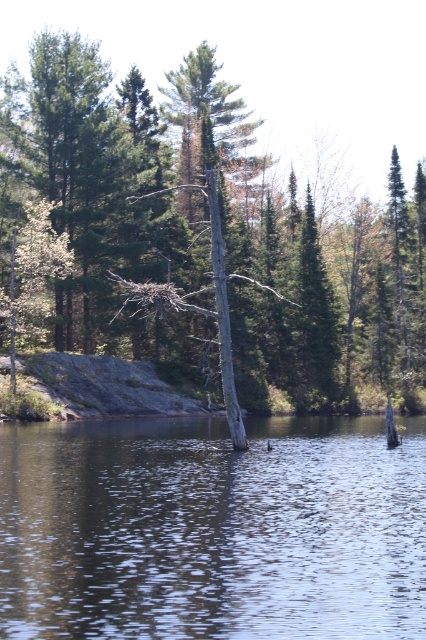
Question: Does smooth gray tree trunk at center appear under transparent water at center?

Choices:
 (A) yes
 (B) no

Answer: (B)

Question: Which point is closer to the camera?

Choices:
 (A) (212, 580)
 (B) (290, 349)

Answer: (A)

Question: Can you confirm if smooth gray tree trunk at center is positioned to the right of transparent water at center?

Choices:
 (A) yes
 (B) no

Answer: (A)

Question: Which of the following is the farthest from the observer?

Choices:
 (A) transparent water at center
 (B) smooth gray tree trunk at center

Answer: (B)

Question: Which point is closer to the camera?

Choices:
 (A) smooth gray tree trunk at center
 (B) transparent water at center

Answer: (B)

Question: Is smooth gray tree trunk at center further to the viewer compared to transparent water at center?

Choices:
 (A) no
 (B) yes

Answer: (B)